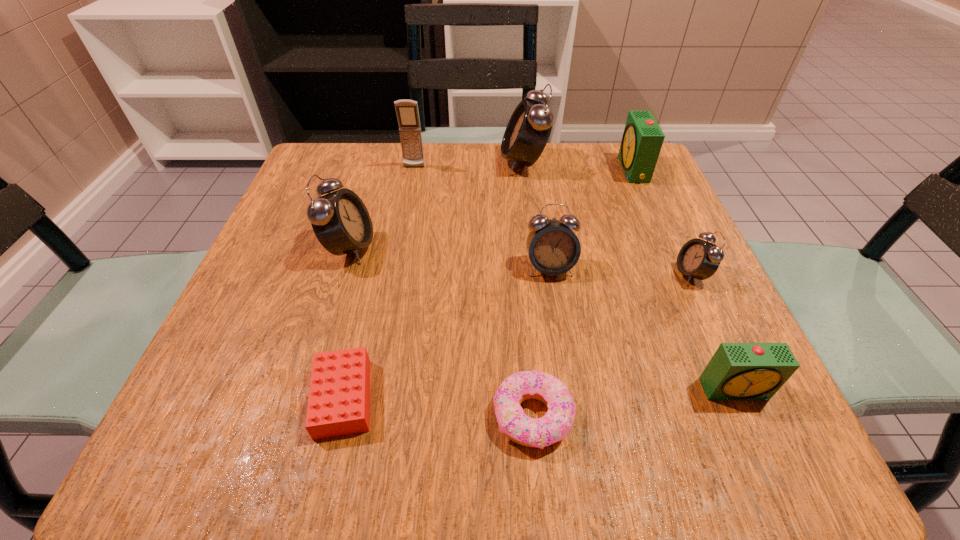
The height and width of the screenshot is (540, 960). I want to click on the tallest alarm clock, so click(x=528, y=130).

At what (x,y) coordinates should I click in order to perform the action: click on the farthest white alarm clock. Please return your answer as a coordinate pair (x, y). The image size is (960, 540). Looking at the image, I should click on (528, 130).

Find the location of a particular element. The image size is (960, 540). gray cellular telephone is located at coordinates [407, 112].

Image resolution: width=960 pixels, height=540 pixels. I want to click on the leftmost alarm clock, so click(x=340, y=220).

The height and width of the screenshot is (540, 960). Identify the location of the second tallest alarm clock. (340, 220).

Locate an element on the screen. Image resolution: width=960 pixels, height=540 pixels. the third biggest white alarm clock is located at coordinates (553, 248).

The image size is (960, 540). Find the location of `the bigger green alarm clock`. the bigger green alarm clock is located at coordinates (642, 140).

Identify the location of the rightmost white alarm clock. (699, 259).

I want to click on the nearer green alarm clock, so (737, 371).

This screenshot has height=540, width=960. Find the location of `the nearest alarm clock`. the nearest alarm clock is located at coordinates (737, 371).